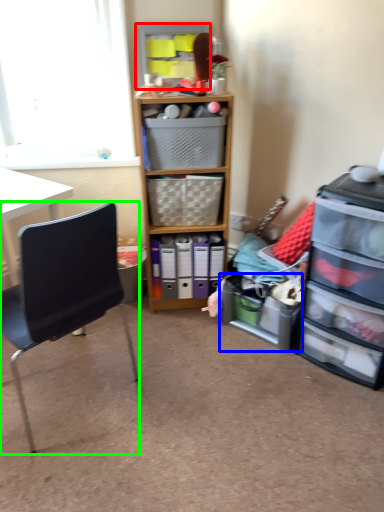
Question: Which object is positioned closest to shelf (highlighted by a red box)? Select from shelf (highlighted by a blue box) and chair (highlighted by a green box).

Choices:
 (A) shelf
 (B) chair

Answer: (B)